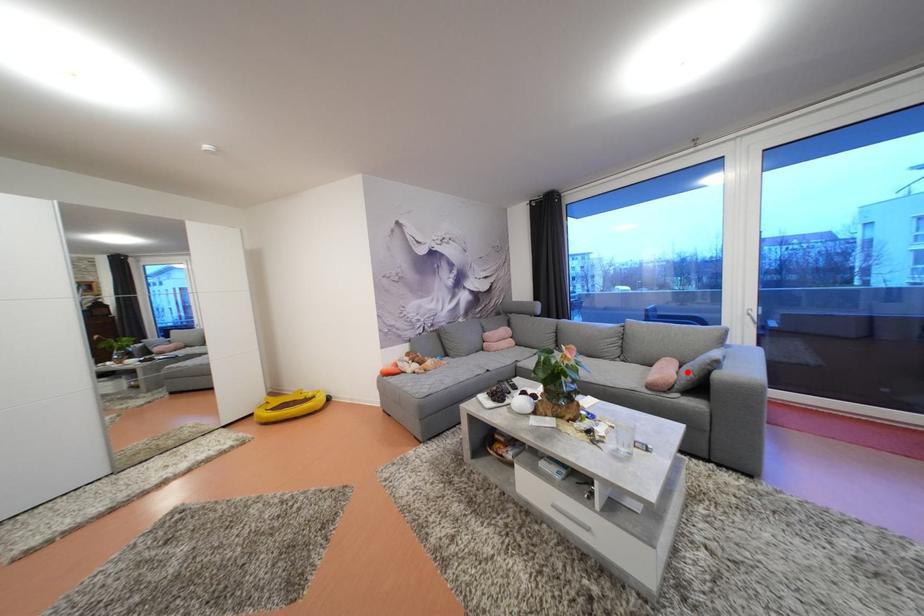
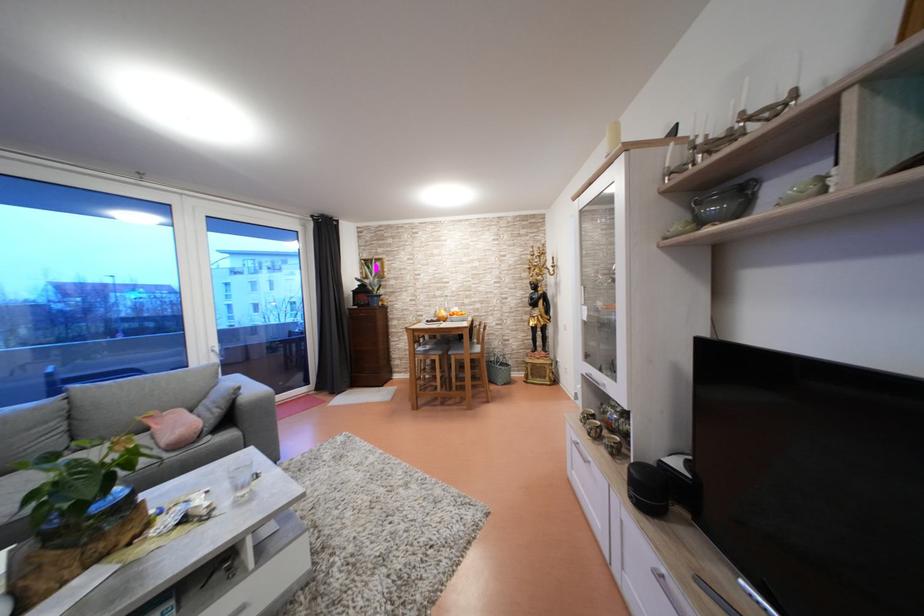
Locate, in the second image, the point that corresponds to the highlighted location in the first image.

(199, 418)